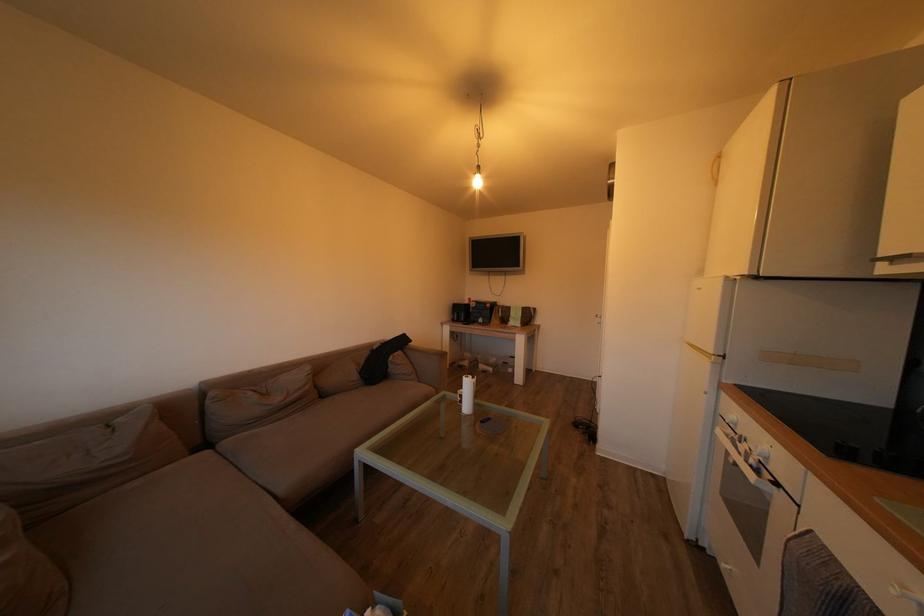
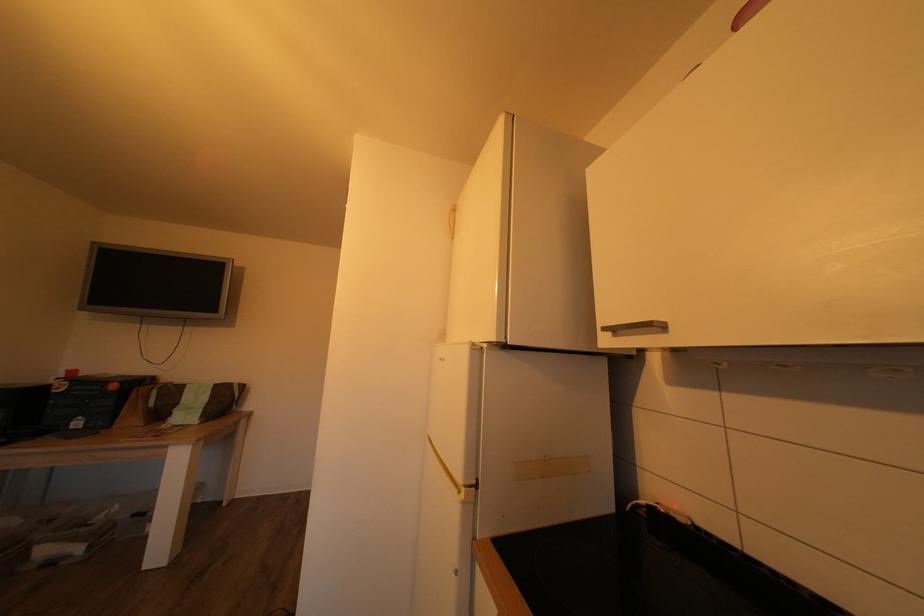
Question: The camera is either moving clockwise (left) or counter-clockwise (right) around the object. The first image is from the beginning of the video and the second image is from the end. Is the camera moving left or right when shooting the video?

Choices:
 (A) Left
 (B) Right

Answer: (A)